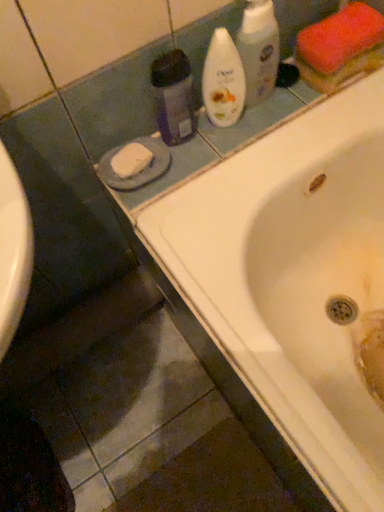
Where is `vacant space in front of white glossy bottle at upper center, which is the 2th cleaning product in left-to-right order`? vacant space in front of white glossy bottle at upper center, which is the 2th cleaning product in left-to-right order is located at coordinates (215, 156).